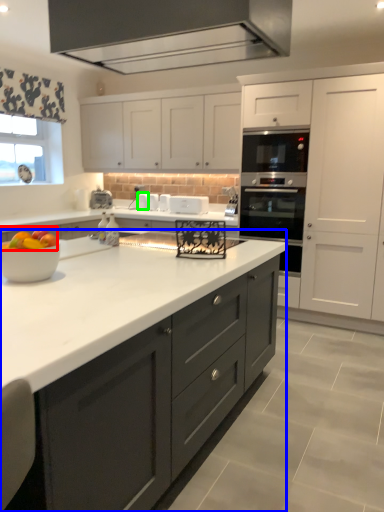
Question: Which is farther away from fruit (highlighted by a red box)? countertop (highlighted by a blue box) or appliance (highlighted by a green box)?

Choices:
 (A) countertop
 (B) appliance

Answer: (B)